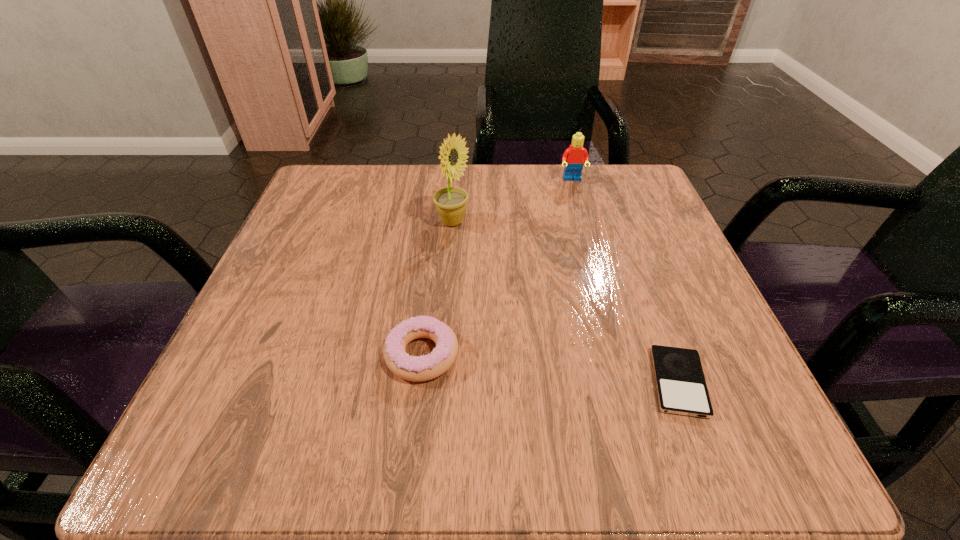
Find the location of a particular element. The width and height of the screenshot is (960, 540). vacant space that is in between the tallest object and the iPod is located at coordinates (565, 302).

This screenshot has height=540, width=960. In order to click on vacant area that lies between the second shortest object and the farthest object in this screenshot , I will do `click(497, 267)`.

Image resolution: width=960 pixels, height=540 pixels. I want to click on free space between the iPod and the sunflower, so click(x=565, y=302).

Choose which object is the nearest neighbor to the doughnut. Please provide its 2D coordinates. Your answer should be formatted as a tuple, i.e. [(x, y)], where the tuple contains the x and y coordinates of a point satisfying the conditions above.

[(451, 202)]

Find the location of `object identified as the second closest to the iPod`. object identified as the second closest to the iPod is located at coordinates click(451, 202).

At what (x,y) coordinates should I click in order to perform the action: click on vacant space that satisfies the following two spatial constraints: 1. on the face of the iPod; 2. on the right side of the sunflower. Please return your answer as a coordinate pair (x, y). Image resolution: width=960 pixels, height=540 pixels. Looking at the image, I should click on (441, 382).

Find the location of `vacant space that satisfies the following two spatial constraints: 1. on the face of the farthest object; 2. on the face of the third nearest object`. vacant space that satisfies the following two spatial constraints: 1. on the face of the farthest object; 2. on the face of the third nearest object is located at coordinates (584, 222).

Find the location of a particular element. The image size is (960, 540). free spot that satisfies the following two spatial constraints: 1. on the face of the iPod; 2. on the right side of the second farthest object is located at coordinates (441, 382).

The width and height of the screenshot is (960, 540). In order to click on free space in the image that satisfies the following two spatial constraints: 1. on the face of the sunflower; 2. on the front side of the doughnut in this screenshot , I will do 443,354.

Where is `free location that satisfies the following two spatial constraints: 1. on the face of the iPod; 2. on the left side of the tallest object`? free location that satisfies the following two spatial constraints: 1. on the face of the iPod; 2. on the left side of the tallest object is located at coordinates (441, 382).